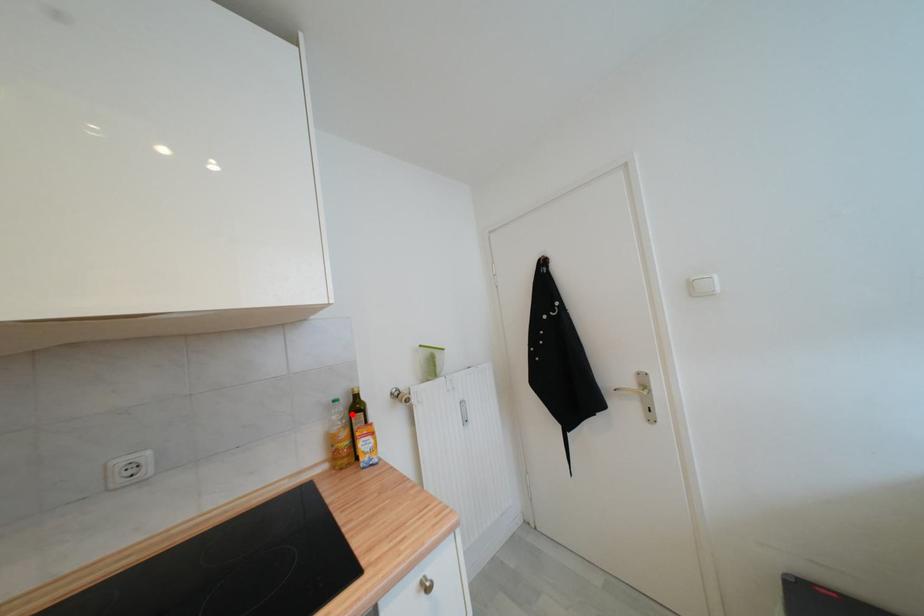
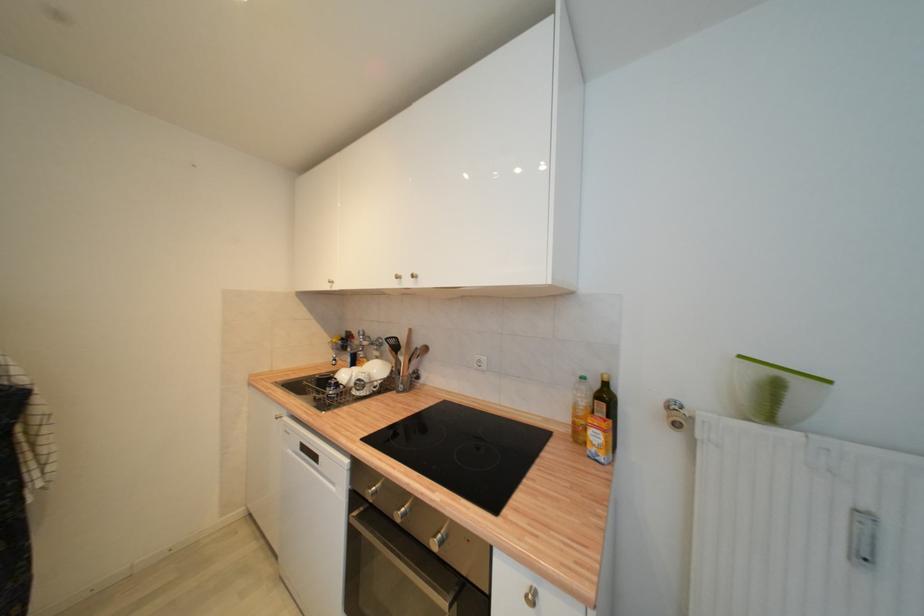
Where in the second image is the point corresponding to the highlighted location from the first image?

(596, 397)